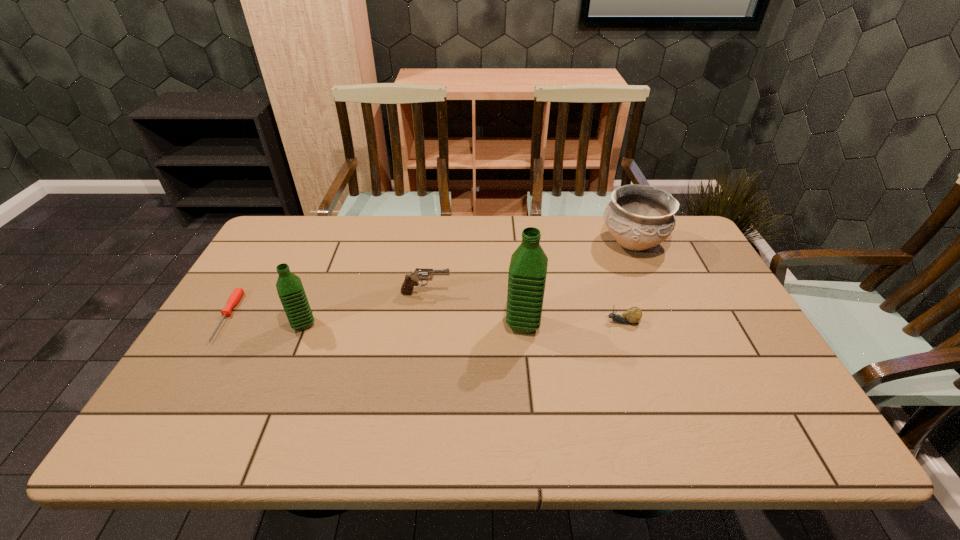
Locate an element on the screen. The width and height of the screenshot is (960, 540). object positioned at the left edge is located at coordinates (235, 297).

I want to click on object located at the right edge, so click(x=639, y=217).

Identify the location of object present at the far right corner. Image resolution: width=960 pixels, height=540 pixels. (639, 217).

The width and height of the screenshot is (960, 540). Find the location of `free location at the far edge of the desktop`. free location at the far edge of the desktop is located at coordinates (338, 228).

You are a GUI agent. You are given a task and a screenshot of the screen. Output one action in this format:
    pyautogui.click(x=<x>, y=<y>)
    Task: Click on the free space at the near edge of the desktop
    This screenshot has height=540, width=960.
    Given the screenshot: What is the action you would take?
    pyautogui.click(x=694, y=397)

Find the location of `vacant space at the left edge of the desktop`. vacant space at the left edge of the desktop is located at coordinates (228, 365).

This screenshot has height=540, width=960. What are the coordinates of `free spot at the right edge of the desktop` in the screenshot? It's located at (719, 363).

The height and width of the screenshot is (540, 960). Find the location of `free space between the taller water bottle and the fifth tallest object`. free space between the taller water bottle and the fifth tallest object is located at coordinates (573, 323).

Identify the location of unoccupied position between the shortest object and the escargot. The width and height of the screenshot is (960, 540). (424, 319).

Identify the location of free spot between the escargot and the tallest object. The height and width of the screenshot is (540, 960). (573, 323).